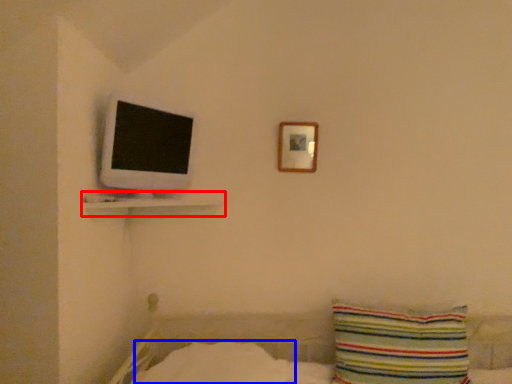
Question: Which object appears farthest to the camera in this image, shelf (highlighted by a red box) or sheet (highlighted by a blue box)?

Choices:
 (A) shelf
 (B) sheet

Answer: (A)